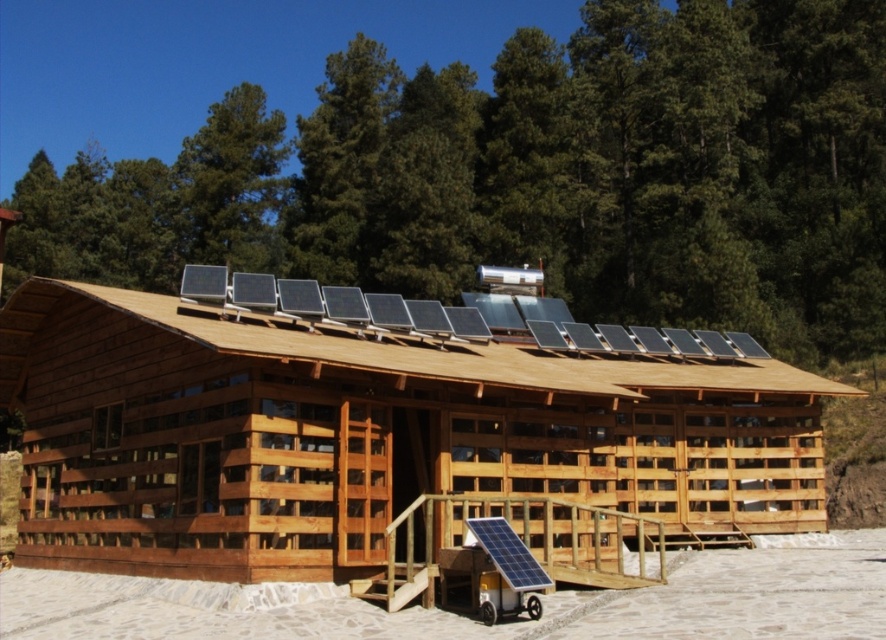
Who is more forward, (140,570) or (686,369)?

Positioned in front is point (140,570).

Between natural wood hut at center and wooden solar panels at center, which one is positioned lower?

natural wood hut at center

The width and height of the screenshot is (886, 640). Find the location of `natural wood hut at center`. natural wood hut at center is located at coordinates (386, 433).

The height and width of the screenshot is (640, 886). In order to click on natural wood hut at center in this screenshot , I will do `click(386, 433)`.